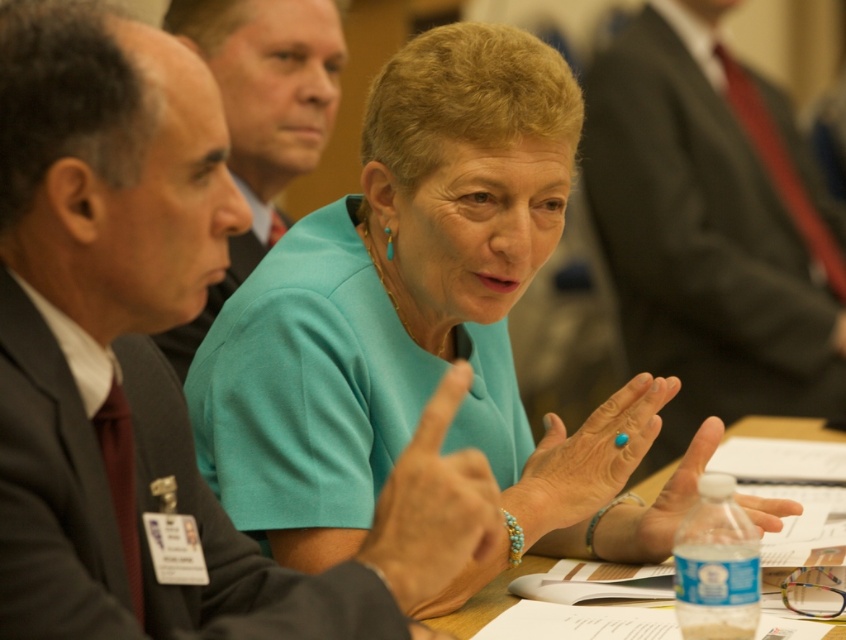
Who is more distant from viewer, [298,276] or [693,154]?

Positioned behind is point [693,154].

Who is positioned more to the left, teal fabric blouse at center or matte black suit at upper right?

From the viewer's perspective, teal fabric blouse at center appears more on the left side.

You are a GUI agent. You are given a task and a screenshot of the screen. Output one action in this format:
    pyautogui.click(x=<x>, y=<y>)
    Task: Click on the teal fabric blouse at center
    Image resolution: width=846 pixels, height=640 pixels.
    Given the screenshot: What is the action you would take?
    pyautogui.click(x=424, y=323)

The image size is (846, 640). I want to click on teal fabric blouse at center, so click(x=424, y=323).

Which is above, matte black suit at upper right or matte black suit at left?

matte black suit at left is above.

Is point (834, 378) more distant than point (255, 42)?

Yes, point (834, 378) is behind point (255, 42).

Locate an element on the screen. Image resolution: width=846 pixels, height=640 pixels. matte black suit at upper right is located at coordinates (712, 225).

Which of these two, matte black suit at center or wooden table at center, stands taller?

matte black suit at center is taller.

Which is behind, point (147, 58) or point (470, 611)?

The point (470, 611) is behind.

Identify the location of matte black suit at center. (135, 209).